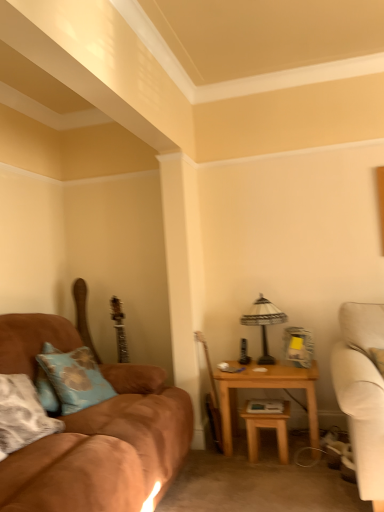
Question: Is wooden table at right, which is the second table in right-to-left order, bigger than light brown wooden table at right, which ranks as the 1th table in right-to-left order?

Choices:
 (A) no
 (B) yes

Answer: (A)

Question: Is wooden table at right, arranged as the first table when viewed from the left, facing away from light brown wooden table at right, the second table positioned from the left?

Choices:
 (A) yes
 (B) no

Answer: (A)

Question: Is wooden table at right, which is the second table in right-to-left order, further to the viewer compared to light brown wooden table at right, which ranks as the 1th table in right-to-left order?

Choices:
 (A) no
 (B) yes

Answer: (A)

Question: Is wooden table at right, arranged as the first table when viewed from the left, next to light brown wooden table at right, the second table positioned from the left, and touching it?

Choices:
 (A) no
 (B) yes

Answer: (A)

Question: Would you say wooden table at right, arranged as the first table when viewed from the left, is outside light brown wooden table at right, which ranks as the 1th table in right-to-left order?

Choices:
 (A) yes
 (B) no

Answer: (B)

Question: Is suede brown couch at left bigger or smaller than blue fabric pillow at left?

Choices:
 (A) small
 (B) big

Answer: (B)

Question: Is suede brown couch at left taller or shorter than blue fabric pillow at left?

Choices:
 (A) tall
 (B) short

Answer: (A)

Question: Which is correct: suede brown couch at left is inside blue fabric pillow at left, or outside of it?

Choices:
 (A) outside
 (B) inside

Answer: (A)

Question: Is suede brown couch at left in front of or behind blue fabric pillow at left in the image?

Choices:
 (A) front
 (B) behind

Answer: (A)

Question: Is point (122, 443) positioned closer to the camera than point (263, 421)?

Choices:
 (A) closer
 (B) farther

Answer: (A)

Question: Is suede brown couch at left wider or thinner than wooden table at right, which is the second table in right-to-left order?

Choices:
 (A) thin
 (B) wide

Answer: (B)

Question: Is suede brown couch at left inside the boundaries of wooden table at right, arranged as the first table when viewed from the left, or outside?

Choices:
 (A) inside
 (B) outside

Answer: (B)

Question: From the image's perspective, is suede brown couch at left positioned above or below wooden table at right, which is the second table in right-to-left order?

Choices:
 (A) below
 (B) above

Answer: (B)

Question: From a real-world perspective, is blue fabric pillow at left positioned above or below suede brown couch at left?

Choices:
 (A) above
 (B) below

Answer: (A)

Question: Is blue fabric pillow at left situated inside suede brown couch at left or outside?

Choices:
 (A) inside
 (B) outside

Answer: (A)